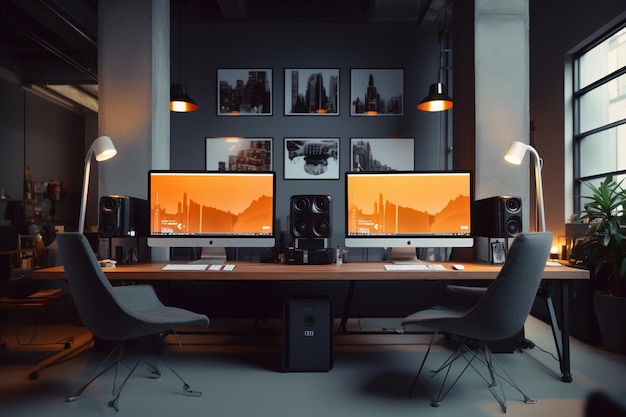
At what (x,y) coordinates should I click in order to perform the action: click on photographs. Please return your answer as a coordinate pair (x, y). Looking at the image, I should click on (377, 157), (321, 157), (245, 157), (238, 90), (295, 94), (375, 90).